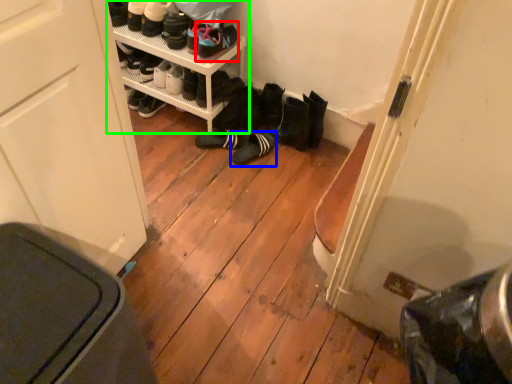
Question: Which is nearer to the footwear (highlighted by a red box)? footwear (highlighted by a blue box) or shelf (highlighted by a green box).

Choices:
 (A) footwear
 (B) shelf

Answer: (B)